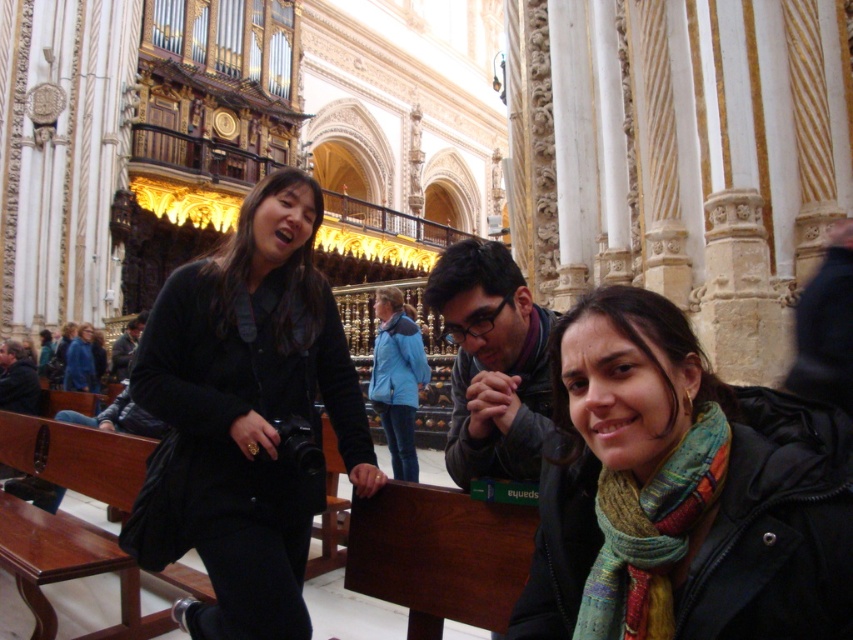
Question: Can you confirm if multicolored scarf at lower right is thinner than matte black jacket at center?

Choices:
 (A) yes
 (B) no

Answer: (B)

Question: In this image, where is multicolored scarf at lower right located relative to matte black jacket at center?

Choices:
 (A) above
 (B) below

Answer: (B)

Question: Estimate the real-world distances between objects in this image. Which object is closer to the multicolored scarf at lower right?

Choices:
 (A) black matte jacket at center
 (B) blue denim jacket at center
 (C) brown wooden bench at lower left
 (D) dark gray jacket at center

Answer: (A)

Question: Which point is closer to the camera taking this photo?

Choices:
 (A) (494, 288)
 (B) (115, 364)
 (C) (91, 349)

Answer: (A)

Question: Does multicolored scarf at lower right lie behind dark gray jacket at center?

Choices:
 (A) no
 (B) yes

Answer: (A)

Question: Which point is closer to the camera?

Choices:
 (A) black matte jacket at center
 (B) blue denim jacket at center
 (C) multicolored scarf at lower right
 (D) matte black jacket at center

Answer: (C)